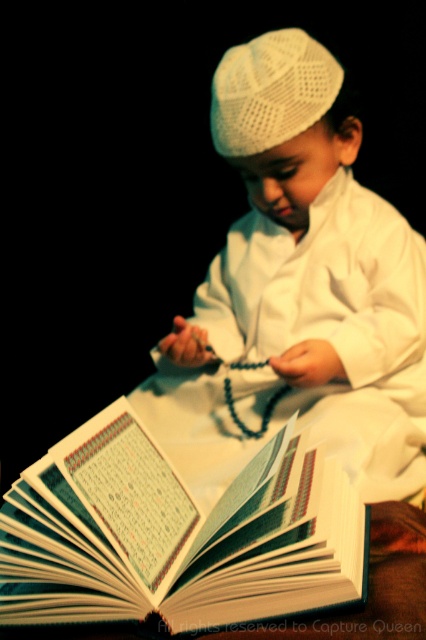
Question: Based on their relative distances, which object is nearer to the white knitted hat at center?

Choices:
 (A) white paper book at center
 (B) white matte/knit cap at upper center

Answer: (B)

Question: Is white matte/knit cap at upper center bigger than white paper book at center?

Choices:
 (A) no
 (B) yes

Answer: (B)

Question: Which point appears farthest from the camera in this image?

Choices:
 (A) (313, 108)
 (B) (209, 458)
 (C) (233, 499)

Answer: (B)

Question: Can you confirm if white matte/knit cap at upper center is bigger than white knitted hat at center?

Choices:
 (A) yes
 (B) no

Answer: (A)

Question: Estimate the real-world distances between objects in this image. Which object is closer to the white knitted hat at center?

Choices:
 (A) white matte/knit cap at upper center
 (B) white paper book at center

Answer: (A)

Question: Can you confirm if white matte/knit cap at upper center is thinner than white paper book at center?

Choices:
 (A) no
 (B) yes

Answer: (A)